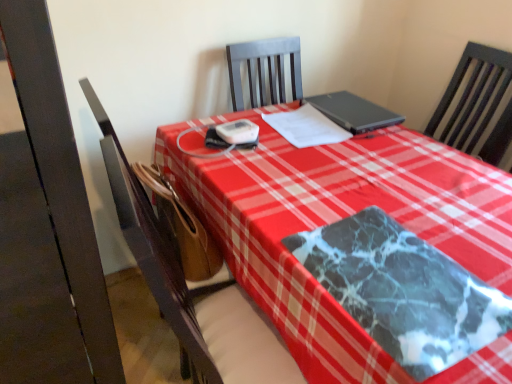
Identify the location of free spot above marble-patterned blanket at center (from a real-world perspective). (398, 271).